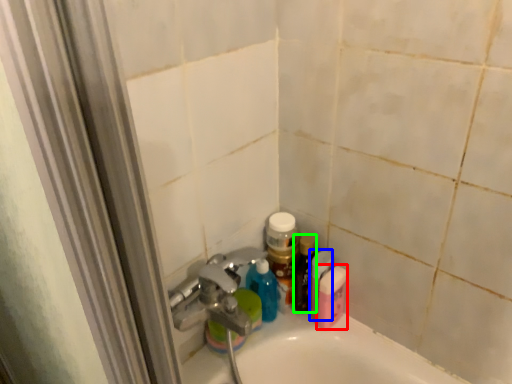
Question: Which is nearer to the mouthwash (highlighted by a red box)? mouthwash (highlighted by a blue box) or toiletry (highlighted by a green box).

Choices:
 (A) mouthwash
 (B) toiletry

Answer: (A)